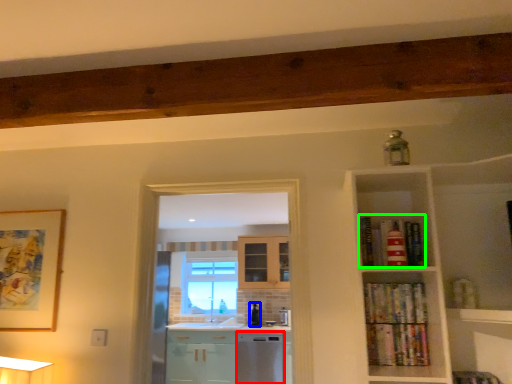
Question: Which object is positioned farthest from dish washer (highlighted by a red box)? Select from appliance (highlighted by a blue box) and book (highlighted by a green box).

Choices:
 (A) appliance
 (B) book

Answer: (B)